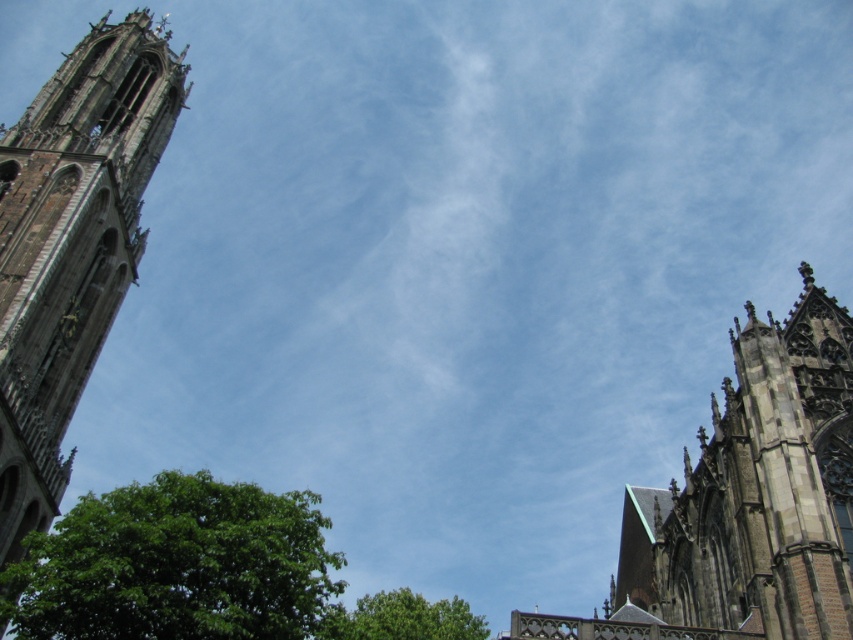
Question: Is stone gothic tower at left to the right of green leafy tree at lower center from the viewer's perspective?

Choices:
 (A) no
 (B) yes

Answer: (A)

Question: Among these objects, which one is nearest to the camera?

Choices:
 (A) green leafy tree at lower left
 (B) green leafy tree at lower center
 (C) stone gothic tower at left
 (D) brown stone tower at right

Answer: (D)

Question: Which object is farther from the camera taking this photo?

Choices:
 (A) stone gothic tower at left
 (B) brown stone tower at right

Answer: (A)

Question: Can you confirm if green leafy tree at lower left is positioned to the left of green leafy tree at lower center?

Choices:
 (A) yes
 (B) no

Answer: (A)

Question: Is stone gothic tower at left bigger than green leafy tree at lower left?

Choices:
 (A) no
 (B) yes

Answer: (A)

Question: Among these objects, which one is nearest to the camera?

Choices:
 (A) green leafy tree at lower center
 (B) green leafy tree at lower left
 (C) brown stone tower at right
 (D) stone gothic tower at left

Answer: (C)